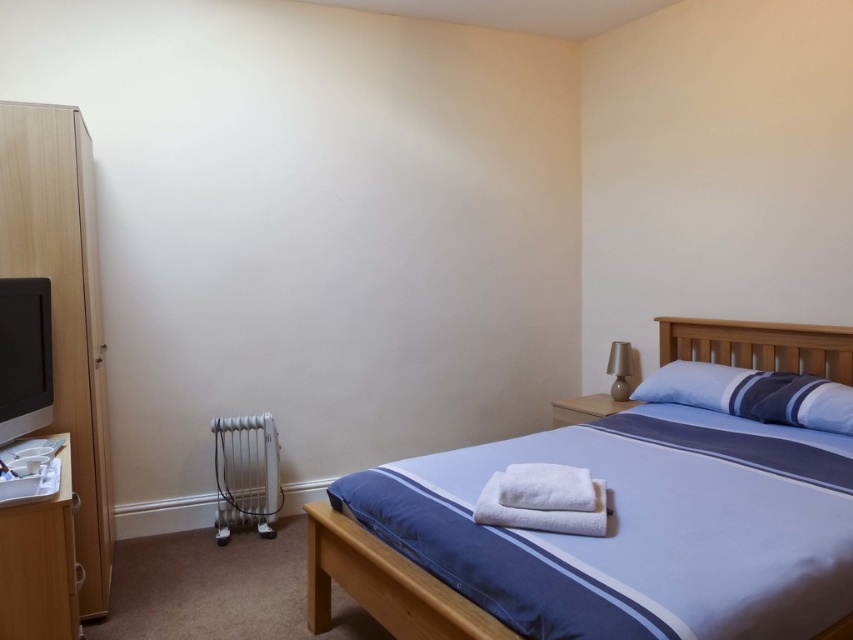
Question: Which point is closer to the camera?

Choices:
 (A) blue fabric bed at center
 (B) white metallic radiator at lower left
 (C) wooden dresser at left
 (D) matte black monitor at left

Answer: (C)

Question: Is matte black monitor at left further to camera compared to matte beige lamp at upper right?

Choices:
 (A) no
 (B) yes

Answer: (A)

Question: Among these points, which one is farthest from the camera?

Choices:
 (A) (233, 492)
 (B) (616, 364)

Answer: (B)

Question: Is light wood dresser at left in front of blue fabric pillow at upper right?

Choices:
 (A) yes
 (B) no

Answer: (A)

Question: Can you confirm if blue fabric pillow at upper right is bigger than matte black monitor at left?

Choices:
 (A) no
 (B) yes

Answer: (B)

Question: Which is nearer to the matte beige lamp at upper right?

Choices:
 (A) blue fabric pillow at upper right
 (B) white metallic radiator at lower left

Answer: (A)